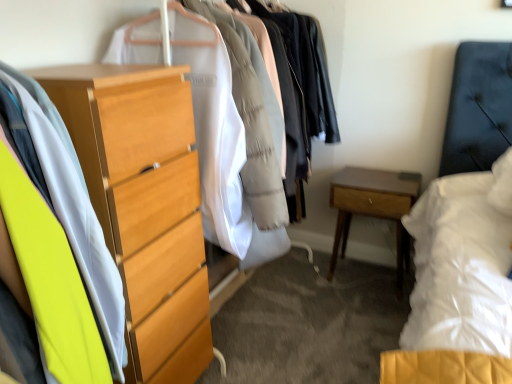
Question: From the image's perspective, is light brown wood nightstand at lower right on top of light wood chest of drawers at left?

Choices:
 (A) yes
 (B) no

Answer: (B)

Question: Is light brown wood nightstand at lower right further to the viewer compared to light wood chest of drawers at left?

Choices:
 (A) no
 (B) yes

Answer: (B)

Question: From a real-world perspective, is light brown wood nightstand at lower right positioned over light wood chest of drawers at left based on gravity?

Choices:
 (A) yes
 (B) no

Answer: (B)

Question: Is light brown wood nightstand at lower right closer to the viewer compared to light wood chest of drawers at left?

Choices:
 (A) yes
 (B) no

Answer: (B)

Question: Can you confirm if light brown wood nightstand at lower right is positioned to the right of light wood chest of drawers at left?

Choices:
 (A) yes
 (B) no

Answer: (A)

Question: Is light wood chest of drawers at left surrounded by light brown wood nightstand at lower right?

Choices:
 (A) yes
 (B) no

Answer: (B)

Question: From a real-world perspective, is light wood chest of drawers at left positioned under wooden chest of drawers at center, which ranks as the second closet in front-to-back order, based on gravity?

Choices:
 (A) no
 (B) yes

Answer: (B)

Question: Can you confirm if light wood chest of drawers at left is smaller than wooden chest of drawers at center, which ranks as the second closet in front-to-back order?

Choices:
 (A) no
 (B) yes

Answer: (A)

Question: Is light wood chest of drawers at left at the right side of wooden chest of drawers at center, which ranks as the second closet in front-to-back order?

Choices:
 (A) yes
 (B) no

Answer: (B)

Question: Is light wood chest of drawers at left positioned behind wooden chest of drawers at center, which ranks as the second closet in front-to-back order?

Choices:
 (A) no
 (B) yes

Answer: (A)

Question: Is there a large distance between light wood chest of drawers at left and wooden chest of drawers at center, which ranks as the second closet in front-to-back order?

Choices:
 (A) yes
 (B) no

Answer: (B)

Question: Is light wood chest of drawers at left oriented away from wooden chest of drawers at center, arranged as the 1th closet when viewed from the back?

Choices:
 (A) yes
 (B) no

Answer: (B)

Question: Can you confirm if light wood dresser at left, which is the second closet in back-to-front order, is positioned to the left of light wood chest of drawers at left?

Choices:
 (A) no
 (B) yes

Answer: (A)